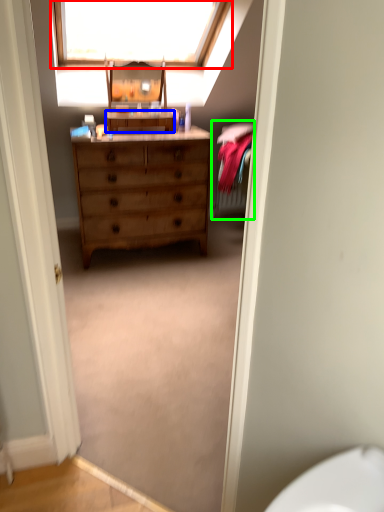
Question: Estimate the real-world distances between objects in this image. Which object is farther from window (highlighted by a red box), cabinetry (highlighted by a blue box) or bed (highlighted by a green box)?

Choices:
 (A) cabinetry
 (B) bed

Answer: (B)